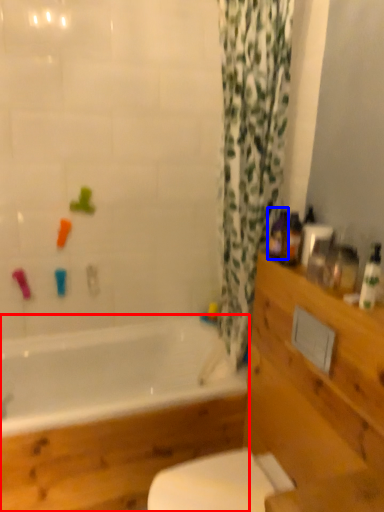
Question: Which object appears closest to the camera in this image, bathtub (highlighted by a red box) or toiletry (highlighted by a blue box)?

Choices:
 (A) bathtub
 (B) toiletry

Answer: (A)